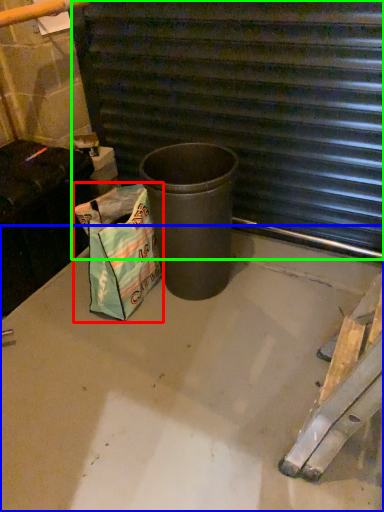
Question: Which object is positioned farthest from shopping bag (highlighted by a red box)? Select from concrete (highlighted by a blue box) and stairwell (highlighted by a green box).

Choices:
 (A) concrete
 (B) stairwell

Answer: (B)